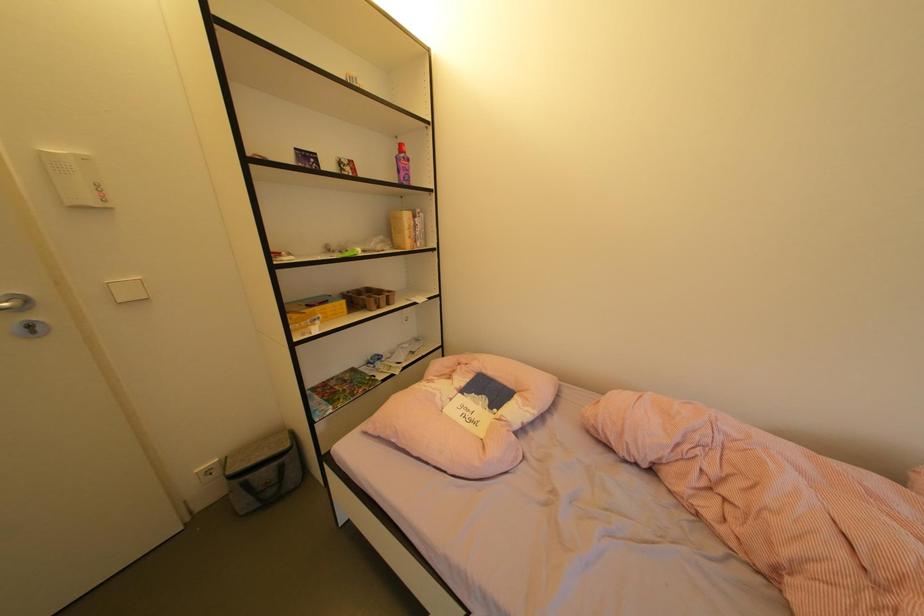
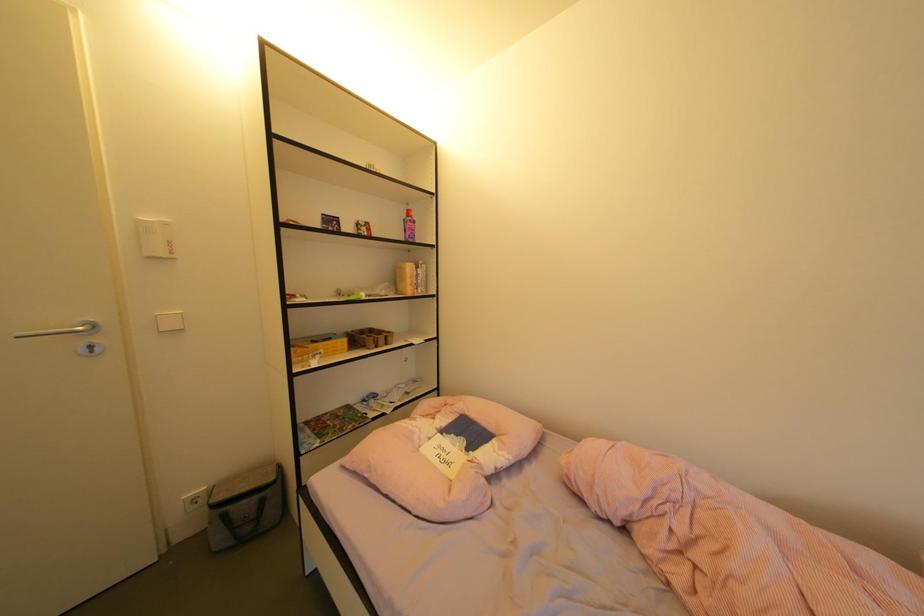
What movement of the cameraman would produce the second image?

The movement direction of the cameraman is right, backward.